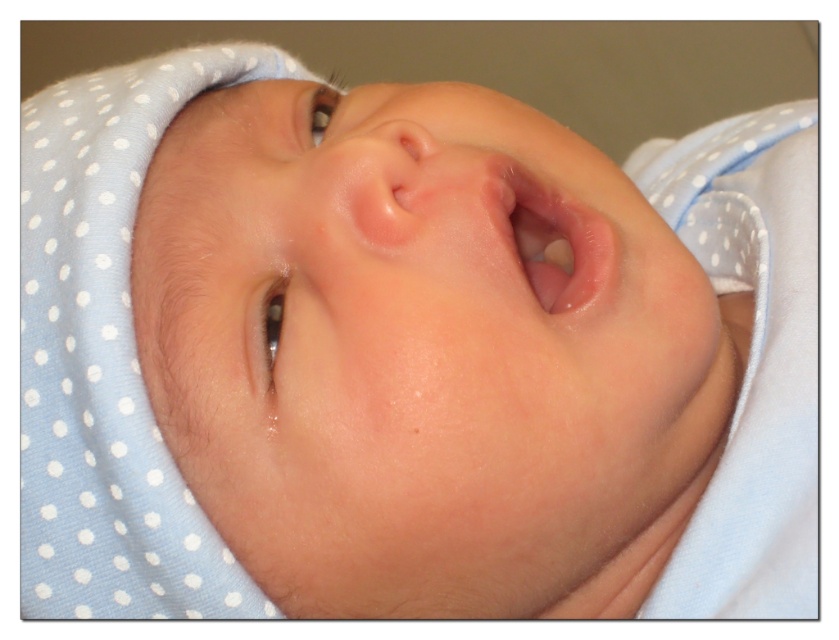
Question: Is smooth skin face at center positioned behind smooth flesh-colored mouth at center?

Choices:
 (A) no
 (B) yes

Answer: (A)

Question: Among these points, which one is farthest from the camera?

Choices:
 (A) (233, 394)
 (B) (556, 301)

Answer: (B)

Question: Is smooth skin face at center to the left of smooth flesh-colored mouth at center from the viewer's perspective?

Choices:
 (A) yes
 (B) no

Answer: (A)

Question: In this image, where is smooth skin face at center located relative to smooth flesh-colored mouth at center?

Choices:
 (A) below
 (B) above

Answer: (A)